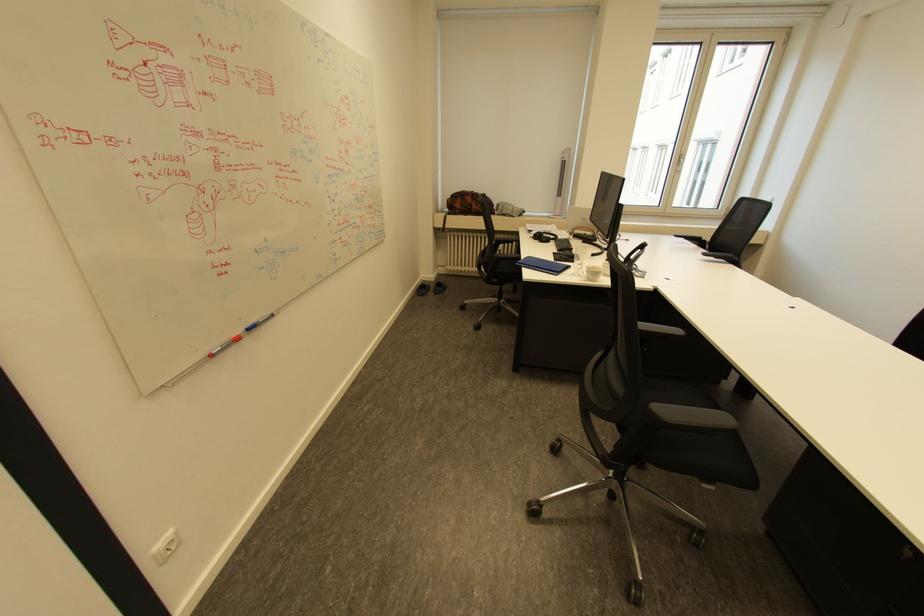
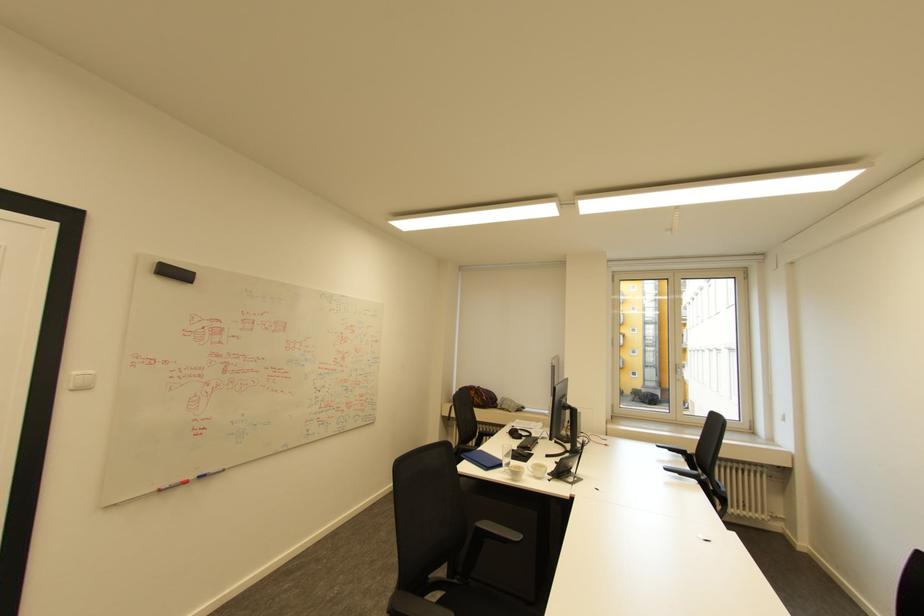
The point at (257,329) is marked in the first image. Where is the corresponding point in the second image?

(207, 477)